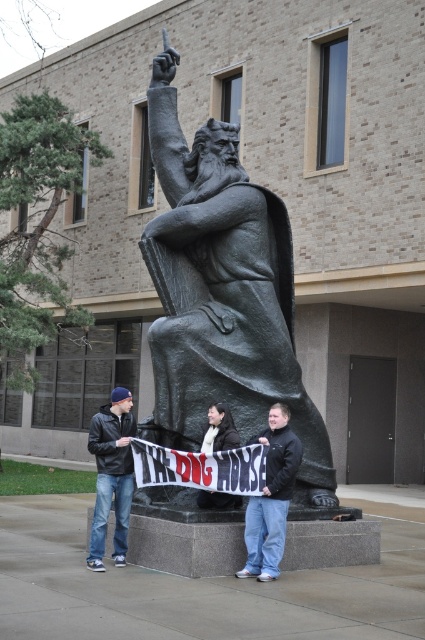
Based on the photo, how distant is matte black jacket at center from white scarf at center?

matte black jacket at center is 97.27 centimeters from white scarf at center.

Can you confirm if matte black jacket at center is positioned to the left of white scarf at center?

No, matte black jacket at center is not to the left of white scarf at center.

Who is more forward, (283,493) or (207,506)?

Point (283,493) is in front.

I want to click on matte black jacket at center, so click(272, 497).

Which is above, bronze statue at center or black leather jacket at lower left?

Positioned higher is bronze statue at center.

Who is more forward, (187, 397) or (95, 563)?

Point (95, 563)

Locate an element on the screen. This screenshot has height=640, width=425. bronze statue at center is located at coordinates (221, 292).

Can you confirm if bronze statue at center is smaller than matte black jacket at center?

Yes, bronze statue at center is smaller than matte black jacket at center.

The image size is (425, 640). What do you see at coordinates (221, 292) in the screenshot? I see `bronze statue at center` at bounding box center [221, 292].

Find the location of a particular element. The image size is (425, 640). bronze statue at center is located at coordinates (221, 292).